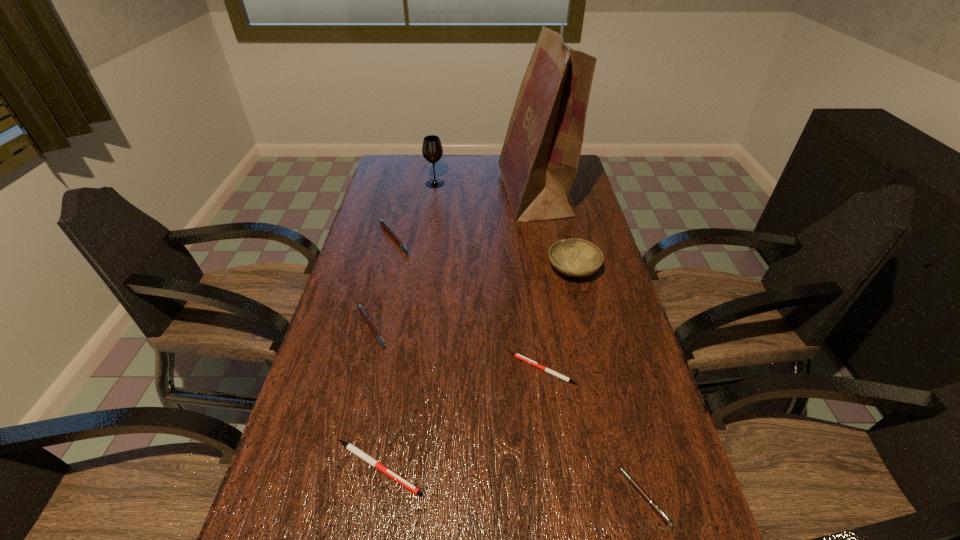
Find the location of a particular element. This screenshot has width=960, height=540. vacant point located at the nib of the biggest pink pen is located at coordinates (x=472, y=239).

Where is `free space located 0.090m at the nib of the fourth nearest pen`? free space located 0.090m at the nib of the fourth nearest pen is located at coordinates (424, 328).

Identify the location of vacant space located 0.180m on the clicker of the nearer white pen. (513, 468).

You are a GUI agent. You are given a task and a screenshot of the screen. Output one action in this format:
    pyautogui.click(x=<x>, y=<y>)
    Task: Click on the vacant point located 0.170m at the nib of the rightmost pink pen
    The height and width of the screenshot is (540, 960).
    Given the screenshot: What is the action you would take?
    pyautogui.click(x=539, y=497)

The height and width of the screenshot is (540, 960). What are the coordinates of `vacant space situated at the nib of the rightmost pink pen` in the screenshot? It's located at (554, 497).

Locate an element on the screen. free space located 0.160m at the nib of the rightmost pink pen is located at coordinates 543,497.

The height and width of the screenshot is (540, 960). Find the location of `vacant space located on the clicker of the third nearest object`. vacant space located on the clicker of the third nearest object is located at coordinates (476, 370).

The height and width of the screenshot is (540, 960). In order to click on free space located 0.120m on the clicker of the third nearest object in this screenshot , I will do `click(465, 370)`.

Locate an element on the screen. The width and height of the screenshot is (960, 540). free region located on the clicker of the third nearest object is located at coordinates (372, 370).

Image resolution: width=960 pixels, height=540 pixels. Identify the location of grocery bag present at the far edge. (539, 161).